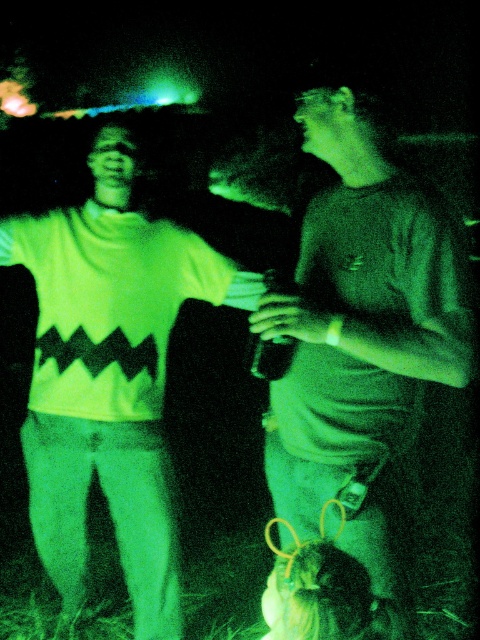
You are a photographer adjusting your camera settings to focus on two specific points in the image. The first point is at coordinates point [262,307] and the second is at point [215,278]. Which point should you focus on first if you want to ensure the closest object is in sharp focus?

Point [262,307] is closer to the viewer than point [215,278], so you should focus on point [262,307] first to ensure the closest object is in sharp focus.